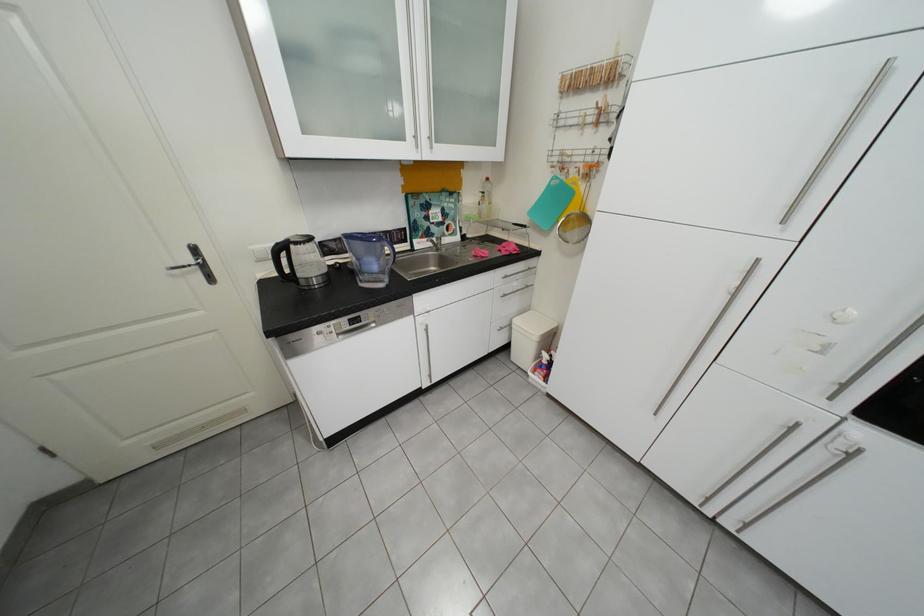
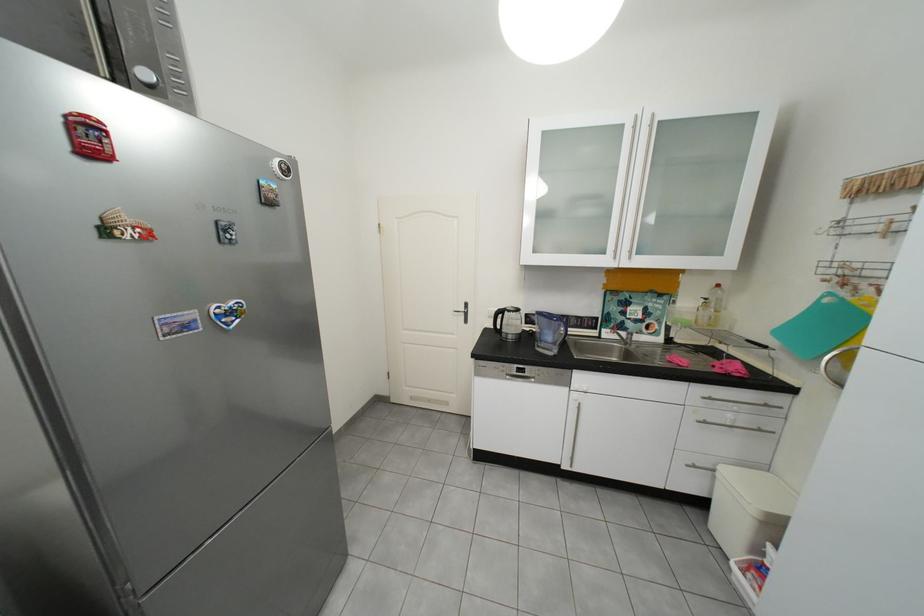
Question: The first image is from the beginning of the video and the second image is from the end. How did the camera likely rotate when shooting the video?

Choices:
 (A) Left
 (B) Right
 (C) Up
 (D) Down

Answer: (A)